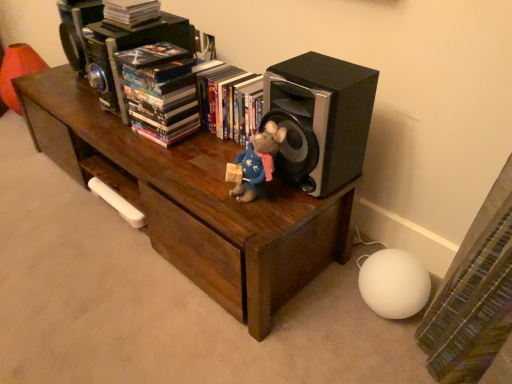
This screenshot has height=384, width=512. Find the location of `brown wood table at center`. brown wood table at center is located at coordinates (194, 201).

The width and height of the screenshot is (512, 384). I want to click on matte black book at upper center, the 3th book in the right-to-left sequence, so click(x=131, y=12).

How different are the orientations of hardcover book at center, arranged as the first book when viewed from the right, and brown wood table at center in degrees?

The angular difference between hardcover book at center, arranged as the first book when viewed from the right, and brown wood table at center is 1.58 degrees.

From a real-world perspective, who is located higher, hardcover book at center, the third book from the left, or brown wood table at center?

From a 3D spatial view, hardcover book at center, the third book from the left, is above.

Considering the relative sizes of hardcover book at center, the third book from the left, and brown wood table at center in the image provided, is hardcover book at center, the third book from the left, thinner than brown wood table at center?

Yes, hardcover book at center, the third book from the left, is thinner than brown wood table at center.

How much distance is there between hardcover book at center, the third book from the left, and brown wood table at center?

hardcover book at center, the third book from the left, and brown wood table at center are 11.30 inches apart.

Considering the points (355, 106) and (154, 50), which point is in front, point (355, 106) or point (154, 50)?

The point (355, 106) is closer to the camera.

From their relative heights in the image, would you say black matte speaker at right is taller or shorter than multicolored paperbacks at upper center, positioned as the second book in right-to-left order?

Clearly, black matte speaker at right is taller compared to multicolored paperbacks at upper center, positioned as the second book in right-to-left order.

Is black matte speaker at right turned away from multicolored paperbacks at upper center, the 2th book when ordered from left to right?

That's not correct — black matte speaker at right is not looking away from multicolored paperbacks at upper center, the 2th book when ordered from left to right.

Considering the sizes of objects black matte speaker at right and multicolored paperbacks at upper center, positioned as the second book in right-to-left order, in the image provided, who is thinner, black matte speaker at right or multicolored paperbacks at upper center, positioned as the second book in right-to-left order,?

Thinner between the two is multicolored paperbacks at upper center, positioned as the second book in right-to-left order.

Could you tell me if multicolored paperbacks at upper center, positioned as the second book in right-to-left order, is turned towards black matte speaker at right?

No, multicolored paperbacks at upper center, positioned as the second book in right-to-left order, does not turn towards black matte speaker at right.

Considering the relative sizes of multicolored paperbacks at upper center, the 2th book when ordered from left to right, and black matte speaker at right in the image provided, is multicolored paperbacks at upper center, the 2th book when ordered from left to right, taller than black matte speaker at right?

No.

Starting from the black matte speaker at right, which book is the 2nd one to the left? Please provide its 2D coordinates.

[(160, 92)]

How distant is brown wood table at center from multicolored paperbacks at upper center, positioned as the second book in right-to-left order?

They are 10.15 inches apart.

Which of these two, brown wood table at center or multicolored paperbacks at upper center, the 2th book when ordered from left to right, stands taller?

With more height is brown wood table at center.

Would you say brown wood table at center is outside multicolored paperbacks at upper center, positioned as the second book in right-to-left order?

brown wood table at center lies outside multicolored paperbacks at upper center, positioned as the second book in right-to-left order,'s area.

Locate an element on the screen. This screenshot has width=512, height=384. table that appears in front of the multicolored paperbacks at upper center, the 2th book when ordered from left to right is located at coordinates (194, 201).

Is there a large distance between brown wood table at center and hardcover book at center, the third book from the left?

brown wood table at center is actually quite close to hardcover book at center, the third book from the left.

From a real-world perspective, does brown wood table at center stand above hardcover book at center, arranged as the first book when viewed from the right?

No, from a real-world perspective, brown wood table at center is not over hardcover book at center, arranged as the first book when viewed from the right

Locate an element on the screen. The image size is (512, 384). table lying below the hardcover book at center, arranged as the first book when viewed from the right (from the image's perspective) is located at coordinates (194, 201).

Is brown wood table at center oriented towards hardcover book at center, arranged as the first book when viewed from the right?

No, brown wood table at center is not oriented towards hardcover book at center, arranged as the first book when viewed from the right.

From a real-world perspective, is matte black book at upper center, the first book positioned from the left, positioned above or below velvety blue plush at center?

matte black book at upper center, the first book positioned from the left, is situated higher than velvety blue plush at center in the real world.

Between matte black book at upper center, the 3th book in the right-to-left sequence, and velvety blue plush at center, which one has more height?

velvety blue plush at center is taller.

Are matte black book at upper center, the first book positioned from the left, and velvety blue plush at center far apart?

No, matte black book at upper center, the first book positioned from the left, is in close proximity to velvety blue plush at center.

Could you tell me if multicolored paperbacks at upper center, positioned as the second book in right-to-left order, is facing hardcover book at center, the third book from the left?

No, multicolored paperbacks at upper center, positioned as the second book in right-to-left order, is not aimed at hardcover book at center, the third book from the left.

Is point (169, 126) less distant than point (241, 79)?

Yes.

Looking at this image, which object is positioned more to the right, multicolored paperbacks at upper center, positioned as the second book in right-to-left order, or hardcover book at center, arranged as the first book when viewed from the right?

From the viewer's perspective, hardcover book at center, arranged as the first book when viewed from the right, appears more on the right side.

Does multicolored paperbacks at upper center, positioned as the second book in right-to-left order, touch hardcover book at center, the third book from the left?

There is a gap between multicolored paperbacks at upper center, positioned as the second book in right-to-left order, and hardcover book at center, the third book from the left.

From the image's perspective, starting from the brown wood table at center, which book is the 1st one above? Please provide its 2D coordinates.

[(230, 102)]

At what (x,y) coordinates should I click in order to perform the action: click on speaker in front of the multicolored paperbacks at upper center, positioned as the second book in right-to-left order. Please return your answer as a coordinate pair (x, y). Looking at the image, I should click on (320, 119).

From the image, which object appears to be farther from velvety blue plush at center, hardcover book at center, arranged as the first book when viewed from the right, or brown wood table at center?

brown wood table at center.

Based on their spatial positions, is hardcover book at center, arranged as the first book when viewed from the right, or black matte speaker at right closer to matte black book at upper center, the first book positioned from the left?

The object closer to matte black book at upper center, the first book positioned from the left, is hardcover book at center, arranged as the first book when viewed from the right.

Considering their positions, is velvety blue plush at center positioned closer to brown wood table at center than multicolored paperbacks at upper center, the 2th book when ordered from left to right?

multicolored paperbacks at upper center, the 2th book when ordered from left to right.

Estimate the real-world distances between objects in this image. Which object is closer to multicolored paperbacks at upper center, the 2th book when ordered from left to right, matte black book at upper center, the first book positioned from the left, or hardcover book at center, the third book from the left?

hardcover book at center, the third book from the left, lies closer to multicolored paperbacks at upper center, the 2th book when ordered from left to right, than the other object.

From the image, which object appears to be nearer to multicolored paperbacks at upper center, positioned as the second book in right-to-left order, brown wood table at center or velvety blue plush at center?

brown wood table at center lies closer to multicolored paperbacks at upper center, positioned as the second book in right-to-left order, than the other object.

Based on their spatial positions, is hardcover book at center, arranged as the first book when viewed from the right, or velvety blue plush at center closer to multicolored paperbacks at upper center, positioned as the second book in right-to-left order?

The object closer to multicolored paperbacks at upper center, positioned as the second book in right-to-left order, is hardcover book at center, arranged as the first book when viewed from the right.

Which object lies nearer to the anchor point hardcover book at center, the third book from the left, multicolored paperbacks at upper center, the 2th book when ordered from left to right, or velvety blue plush at center?

Based on the image, multicolored paperbacks at upper center, the 2th book when ordered from left to right, appears to be nearer to hardcover book at center, the third book from the left.

Estimate the real-world distances between objects in this image. Which object is closer to matte black book at upper center, the 3th book in the right-to-left sequence, hardcover book at center, the third book from the left, or multicolored paperbacks at upper center, positioned as the second book in right-to-left order?

Among the two, multicolored paperbacks at upper center, positioned as the second book in right-to-left order, is located nearer to matte black book at upper center, the 3th book in the right-to-left sequence.

Locate an element on the screen. Image resolution: width=512 pixels, height=384 pixels. toy between multicolored paperbacks at upper center, the 2th book when ordered from left to right, and black matte speaker at right, in the horizontal direction is located at coordinates (258, 162).

Identify the location of book situated between matte black book at upper center, the first book positioned from the left, and hardcover book at center, arranged as the first book when viewed from the right, from left to right. The width and height of the screenshot is (512, 384). (160, 92).

I want to click on table between matte black book at upper center, the 3th book in the right-to-left sequence, and black matte speaker at right from left to right, so click(194, 201).

Where is `toy situated between brown wood table at center and black matte speaker at right from left to right`? This screenshot has height=384, width=512. toy situated between brown wood table at center and black matte speaker at right from left to right is located at coordinates (258, 162).